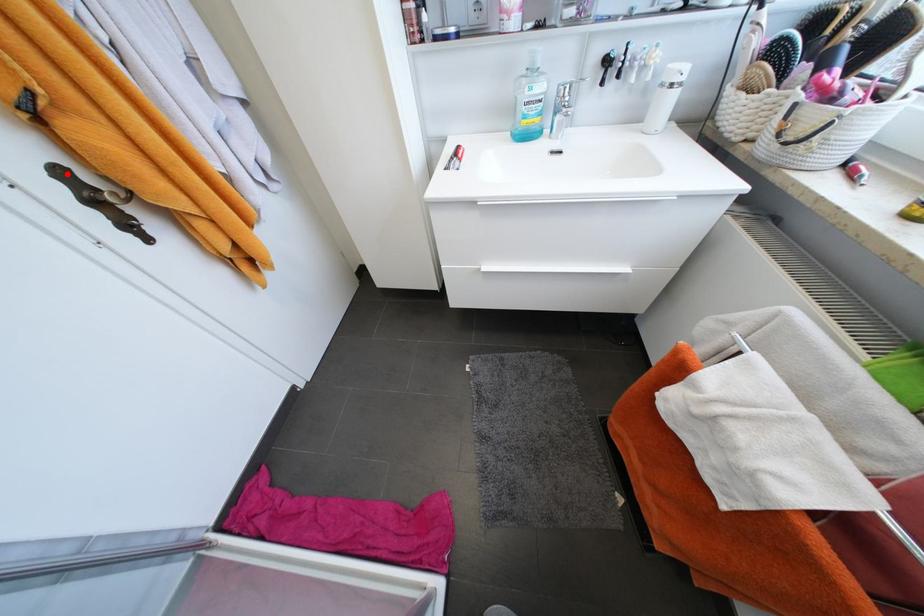
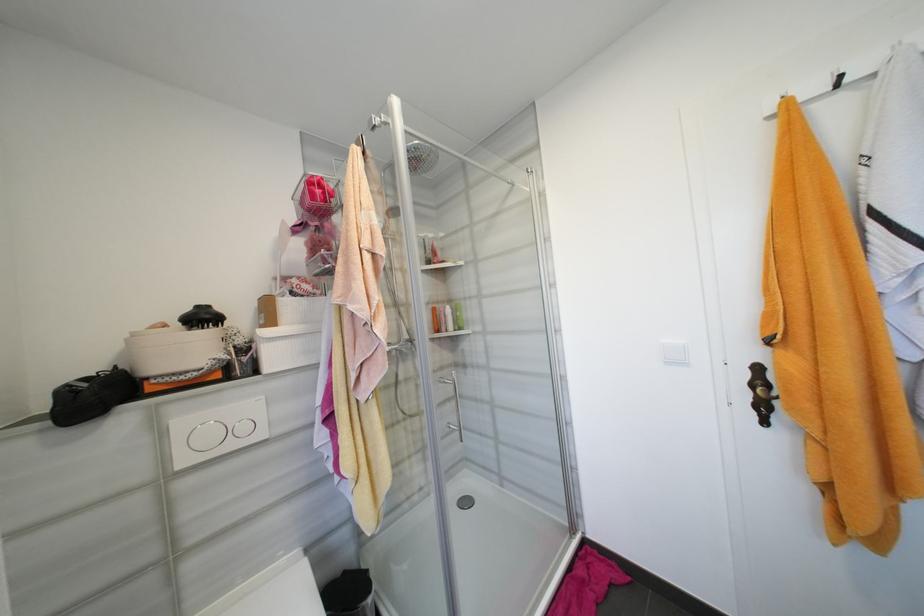
The point at the highlighted location is marked in the first image. Where is the corresponding point in the second image?

(763, 370)